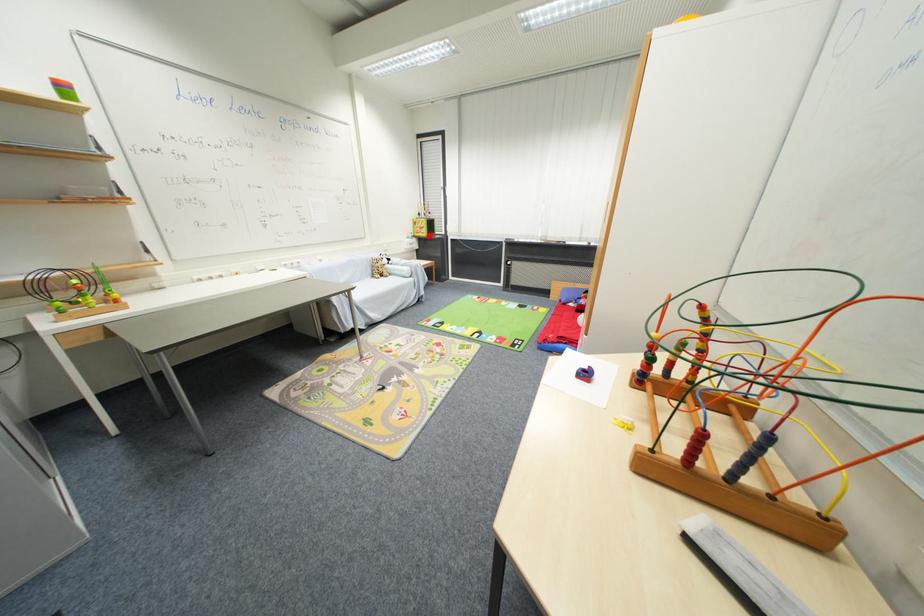
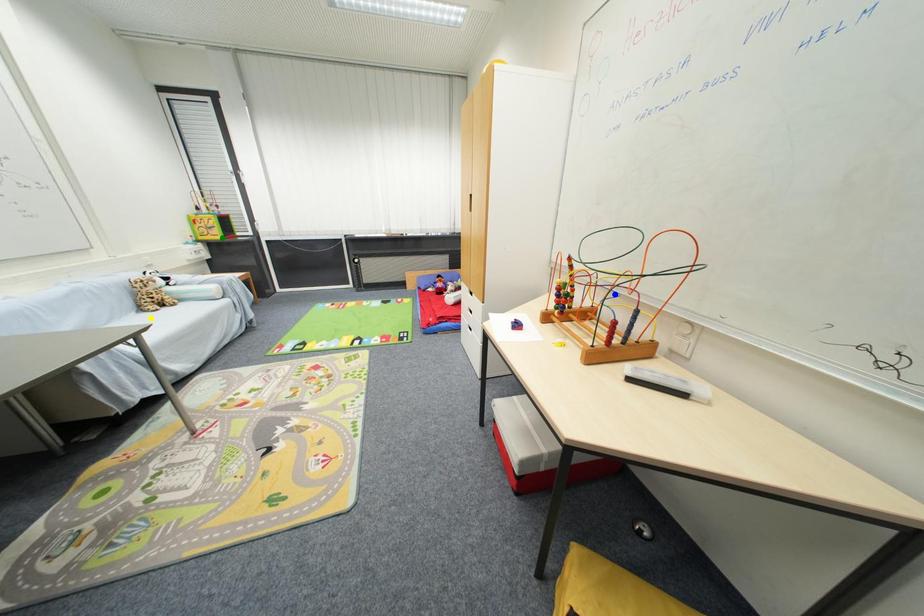
Question: I am providing you with two images of the same scene from different viewpoints. A red point is marked on the first image. You are given multiple points on the second image. In image 2, which mark is for the same physical point as the one in image 1?

Choices:
 (A) blue point
 (B) yellow point
 (C) green point

Answer: (C)